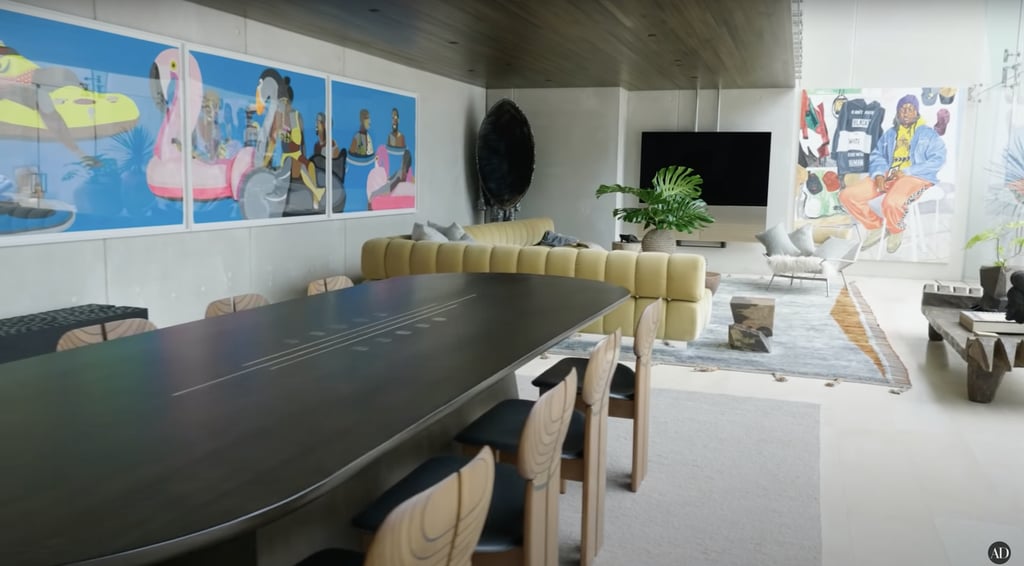
This screenshot has height=566, width=1024. I want to click on stone table, so click(959, 336).